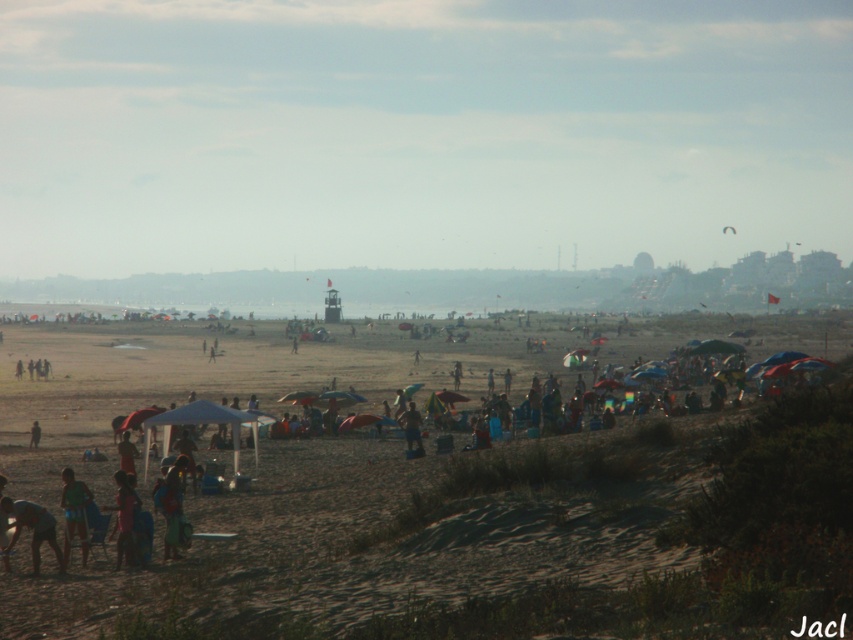
Between green fabric shorts at lower left and light blue fabric umbrella at lower left, which one has less height?

green fabric shorts at lower left is shorter.

Locate an element on the screen. This screenshot has width=853, height=640. green fabric shorts at lower left is located at coordinates (74, 513).

Who is more forward, (79, 513) or (33, 420)?

Point (79, 513)

Where is `green fabric shorts at lower left`? Image resolution: width=853 pixels, height=640 pixels. green fabric shorts at lower left is located at coordinates (74, 513).

What do you see at coordinates (74, 513) in the screenshot?
I see `green fabric shorts at lower left` at bounding box center [74, 513].

Between point (90, 499) and point (120, 518), which one is positioned in front?

Point (120, 518) is in front.

At what (x,y) coordinates should I click in order to perform the action: click on green fabric shorts at lower left. Please return your answer as a coordinate pair (x, y). The height and width of the screenshot is (640, 853). Looking at the image, I should click on (74, 513).

Does brown sandy beach at center have a greater width compared to light blue fabric umbrella at lower left?

Indeed, brown sandy beach at center has a greater width compared to light blue fabric umbrella at lower left.

Can you confirm if brown sandy beach at center is taller than light blue fabric umbrella at lower left?

Yes.

Where is `brown sandy beach at center`? This screenshot has width=853, height=640. brown sandy beach at center is located at coordinates (428, 497).